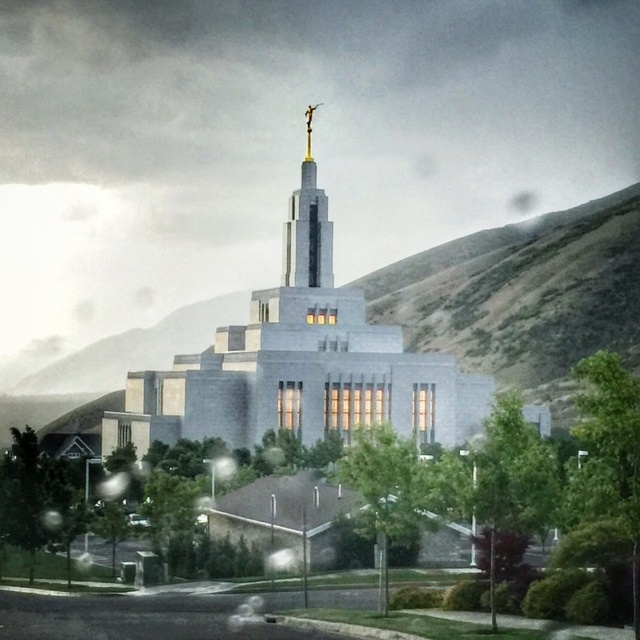
Question: Is white stone church at center smaller than gold polished spire at center?

Choices:
 (A) no
 (B) yes

Answer: (A)

Question: Does white stone church at center lie in front of gold polished spire at center?

Choices:
 (A) yes
 (B) no

Answer: (A)

Question: Estimate the real-world distances between objects in this image. Which object is closer to the white stone church at center?

Choices:
 (A) green leafy tree at lower left
 (B) green leafy tree at center

Answer: (B)

Question: Which of the following is the farthest from the observer?

Choices:
 (A) (394, 448)
 (B) (109, 422)
 (C) (44, 499)
 (D) (324, 256)

Answer: (B)

Question: Does white stone church at center have a smaller size compared to gold polished spire at center?

Choices:
 (A) no
 (B) yes

Answer: (A)

Question: Which is farther from the green leafy tree at lower left?

Choices:
 (A) green leafy tree at center
 (B) white stone church at center

Answer: (B)